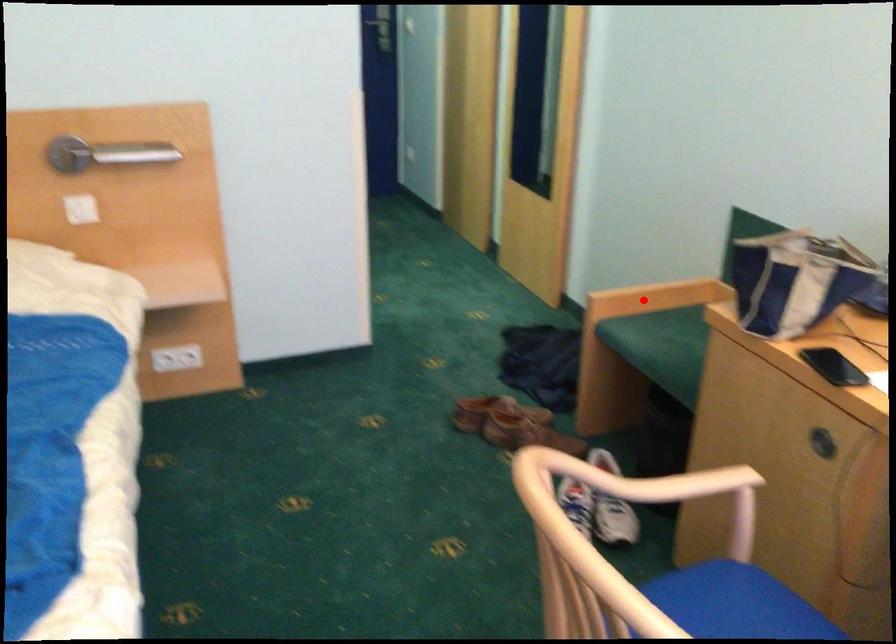
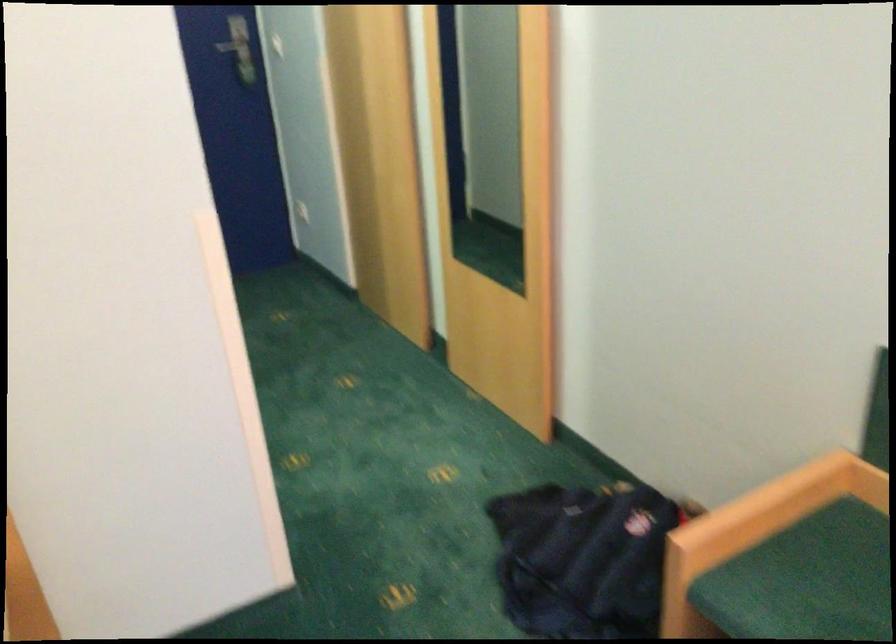
Question: A red point is marked in image1. In image2, is the corresponding 3D point closer to the camera or farther? Reply with the corresponding letter.

Choices:
 (A) The corresponding 3D point is closer.
 (B) The corresponding 3D point is farther.

Answer: (A)